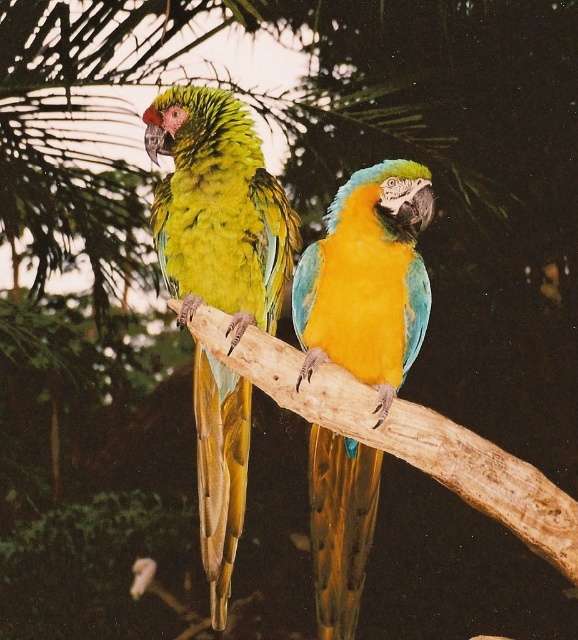
Question: Does shiny blue-green parrot at center have a smaller size compared to brown rough tree branch at center?

Choices:
 (A) yes
 (B) no

Answer: (B)

Question: Which object appears farthest from the camera in this image?

Choices:
 (A) brown rough tree branch at center
 (B) shiny blue-green parrot at center
 (C) green matte parrot at left

Answer: (C)

Question: Is green matte parrot at left smaller than brown rough tree branch at center?

Choices:
 (A) no
 (B) yes

Answer: (A)

Question: Does shiny blue-green parrot at center lie in front of brown rough tree branch at center?

Choices:
 (A) no
 (B) yes

Answer: (B)

Question: Which object appears farthest from the camera in this image?

Choices:
 (A) shiny blue-green parrot at center
 (B) green matte parrot at left

Answer: (B)

Question: Which of these objects is positioned farthest from the green matte parrot at left?

Choices:
 (A) brown rough tree branch at center
 (B) shiny blue-green parrot at center

Answer: (A)